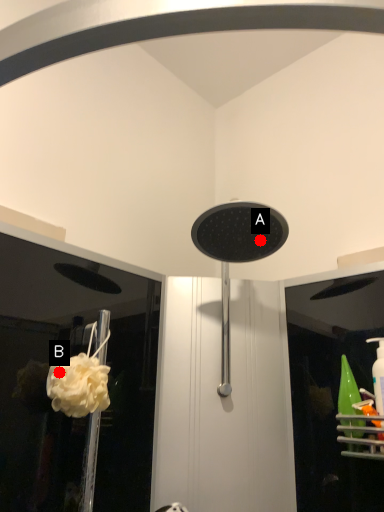
Question: Two points are circled on the image, labeled by A and B beside each circle. Which point appears farthest from the camera in this image?

Choices:
 (A) A is further
 (B) B is further

Answer: (A)